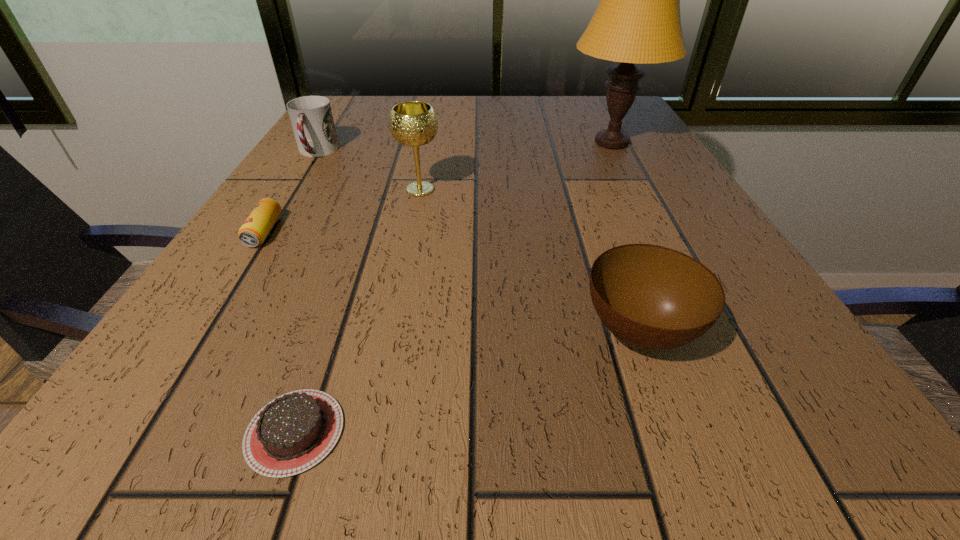
Find the location of a particular element. The width and height of the screenshot is (960, 540). vacant area situated 0.070m on the back of the tallest object is located at coordinates (596, 113).

Where is `vacant area situated 0.100m on the front of the third farthest object`? vacant area situated 0.100m on the front of the third farthest object is located at coordinates (411, 234).

You are a GUI agent. You are given a task and a screenshot of the screen. Output one action in this format:
    pyautogui.click(x=<x>, y=<y>)
    Task: Click on the vacant space situated on the side of the cup where the handle is located
    This screenshot has width=960, height=540.
    Given the screenshot: What is the action you would take?
    pyautogui.click(x=237, y=279)

At what (x,y) coordinates should I click in order to perform the action: click on vacant space situated on the left of the bowl. Please return your answer as a coordinate pair (x, y). The image size is (960, 540). Looking at the image, I should click on (477, 332).

This screenshot has width=960, height=540. What are the coordinates of `vacant position located on the back of the fourth farthest object` in the screenshot? It's located at [330, 129].

At what (x,y) coordinates should I click in order to perform the action: click on vacant space located on the right of the chocolate cake. Please return your answer as a coordinate pair (x, y). The image size is (960, 540). Looking at the image, I should click on (460, 431).

Locate an element on the screen. The image size is (960, 540). object that is positioned at the far edge is located at coordinates (637, 20).

Identify the location of object at the near edge. (295, 431).

At what (x,y) coordinates should I click in order to perform the action: click on cup present at the left edge. Please return your answer as a coordinate pair (x, y). The image size is (960, 540). Looking at the image, I should click on click(x=311, y=117).

Find the location of a particular element. The height and width of the screenshot is (540, 960). beer can present at the left edge is located at coordinates (255, 229).